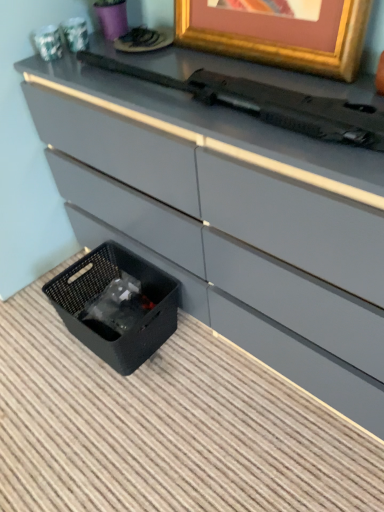
Question: From a real-world perspective, is black woven basket at lower left beneath black plastic typewriter at upper center?

Choices:
 (A) yes
 (B) no

Answer: (A)

Question: Is black woven basket at lower left positioned behind black plastic typewriter at upper center?

Choices:
 (A) yes
 (B) no

Answer: (A)

Question: Considering the relative positions of black woven basket at lower left and black plastic typewriter at upper center in the image provided, is black woven basket at lower left to the left of black plastic typewriter at upper center from the viewer's perspective?

Choices:
 (A) no
 (B) yes

Answer: (B)

Question: Is black woven basket at lower left at the right side of black plastic typewriter at upper center?

Choices:
 (A) yes
 (B) no

Answer: (B)

Question: Does black woven basket at lower left have a greater height compared to black plastic typewriter at upper center?

Choices:
 (A) yes
 (B) no

Answer: (A)

Question: Would you say black plastic typewriter at upper center is to the left or to the right of black woven basket at lower left in the picture?

Choices:
 (A) right
 (B) left

Answer: (A)

Question: From their relative heights in the image, would you say black plastic typewriter at upper center is taller or shorter than black woven basket at lower left?

Choices:
 (A) tall
 (B) short

Answer: (B)

Question: In terms of size, does black plastic typewriter at upper center appear bigger or smaller than black woven basket at lower left?

Choices:
 (A) small
 (B) big

Answer: (A)

Question: From the image's perspective, is black plastic typewriter at upper center positioned above or below black woven basket at lower left?

Choices:
 (A) below
 (B) above

Answer: (B)

Question: Is point click(51, 296) positioned closer to the camera than point click(205, 101)?

Choices:
 (A) farther
 (B) closer

Answer: (A)

Question: Considering the positions of black woven basket at lower left and black plastic typewriter at upper center in the image, is black woven basket at lower left taller or shorter than black plastic typewriter at upper center?

Choices:
 (A) tall
 (B) short

Answer: (A)

Question: In the image, is black woven basket at lower left positioned in front of or behind black plastic typewriter at upper center?

Choices:
 (A) behind
 (B) front

Answer: (A)

Question: Visually, is black woven basket at lower left positioned to the left or to the right of black plastic typewriter at upper center?

Choices:
 (A) right
 (B) left

Answer: (B)

Question: From the image's perspective, is black woven basket at lower left located above or below gold metallic picture frame at upper center?

Choices:
 (A) below
 (B) above

Answer: (A)

Question: Is point (69, 309) positioned closer to the camera than point (347, 60)?

Choices:
 (A) closer
 (B) farther

Answer: (B)